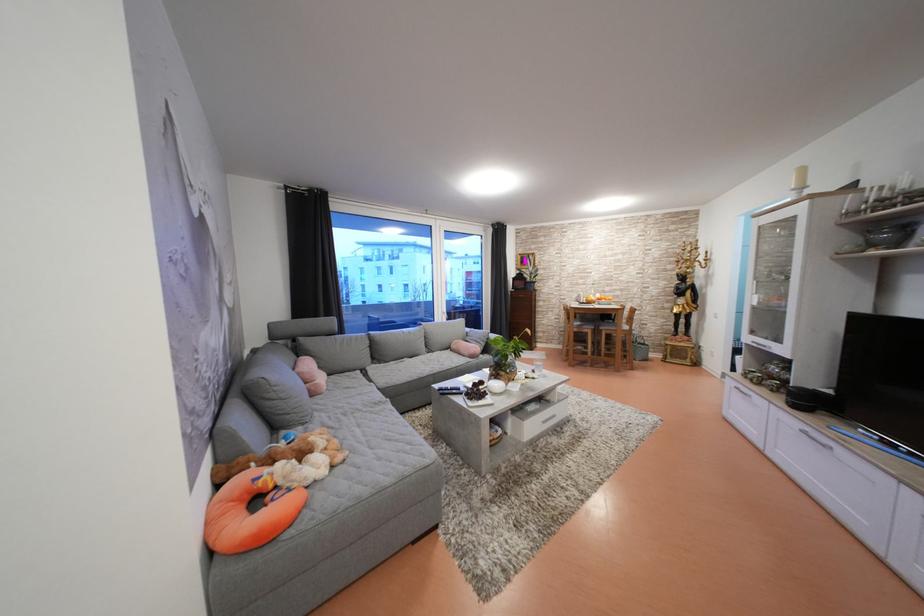
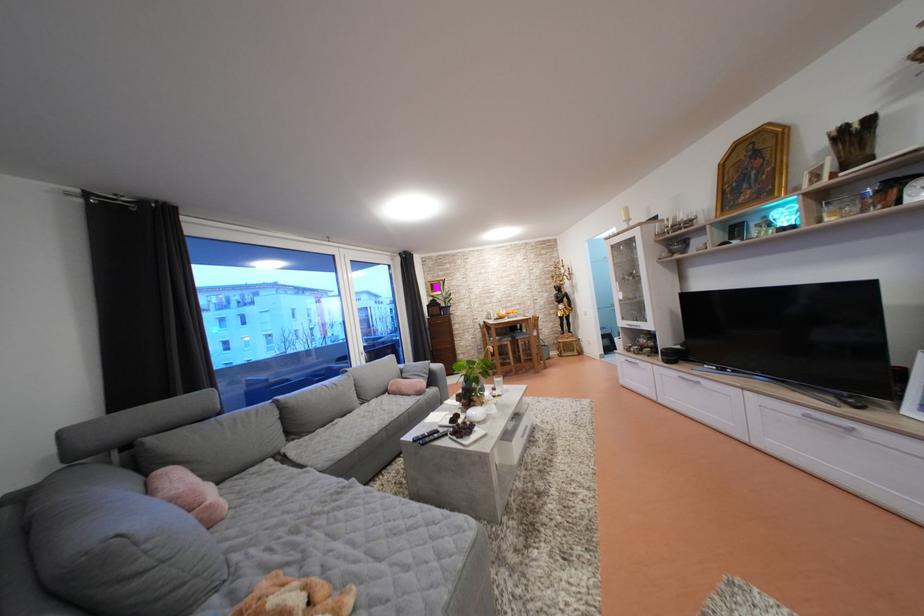
Question: I am providing you with two images of the same scene from different viewpoints. Please identify which objects are invisible in image2.

Choices:
 (A) glass plant vase
 (B) pink decorative pillow
 (C) grey sofa sitting surface
 (D) none of these

Answer: (D)